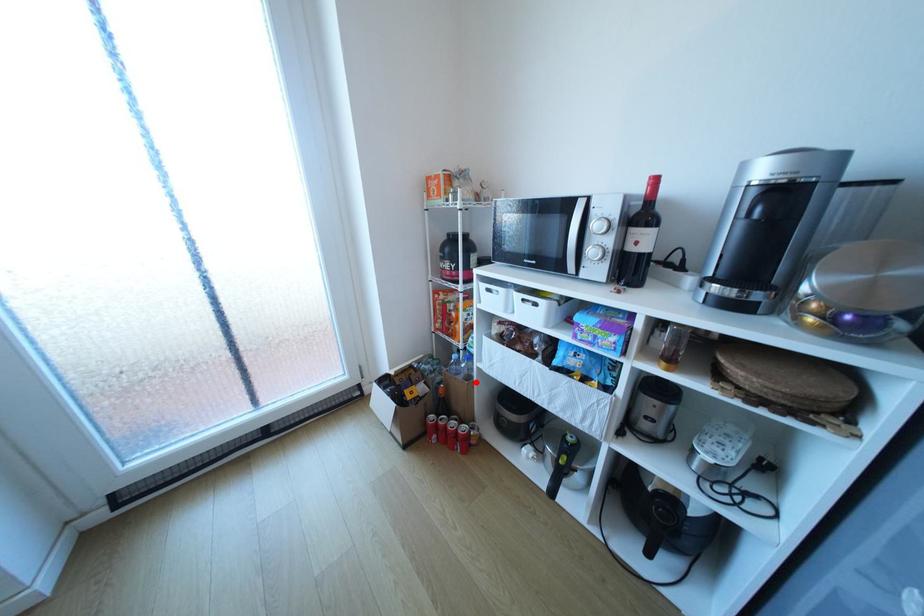
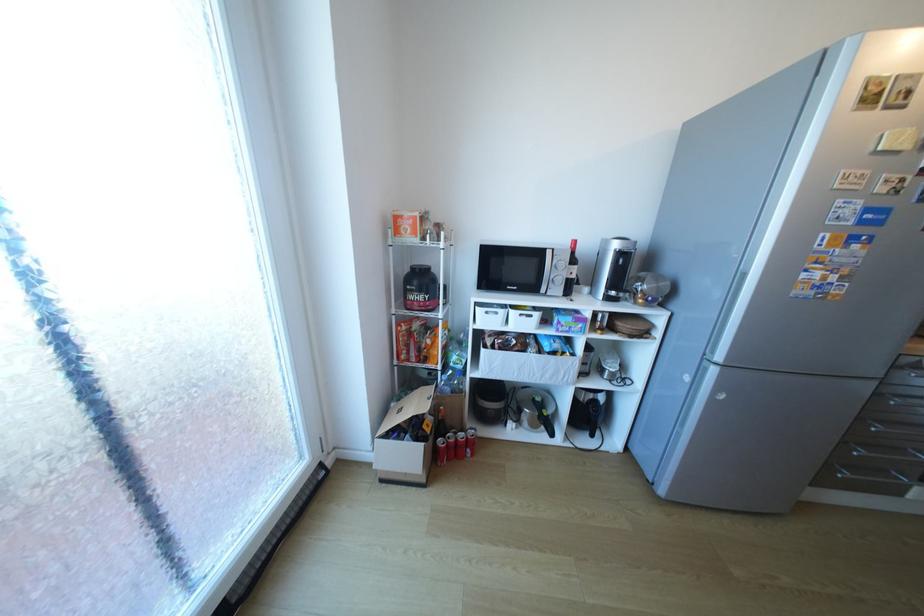
Question: I am providing you with two images of the same scene from different viewpoints. Given a red point in image1, look at the same physical point in image2. Is it:

Choices:
 (A) Closer to the viewpoint
 (B) Farther from the viewpoint

Answer: (B)